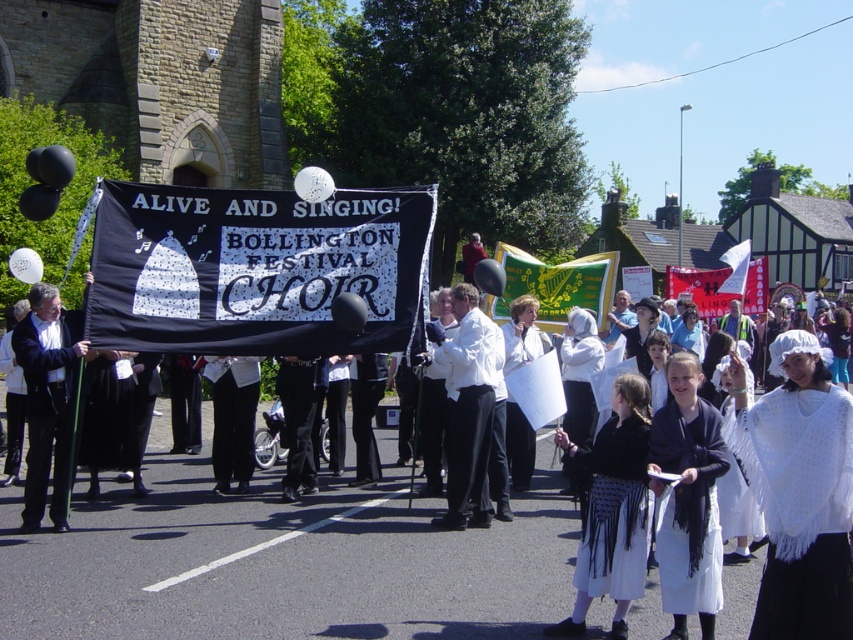
You are standing at the point labeled point (515, 317) and want to walk to the point labeled point (302, 449). Will you have to go around any obstacles along the way?

Since point (302, 449) is behind point (515, 317), you will have to go around obstacles to reach it.

Consider the image. You are a photographer trying to capture the Bollington Festival Choir during their parade. You notice two fabrics in the center of your viewfinder, a black fabric pants at center and a white fabric at center. Which fabric will appear bigger in your photo?

The black fabric pants at center is larger in size than the white fabric at center, so the black fabric pants at center will appear bigger in the photo.